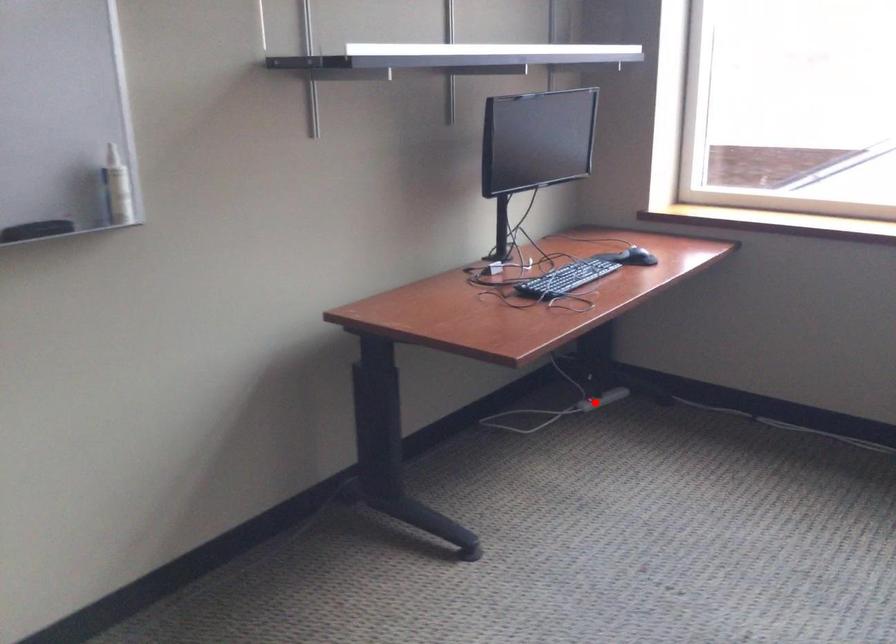
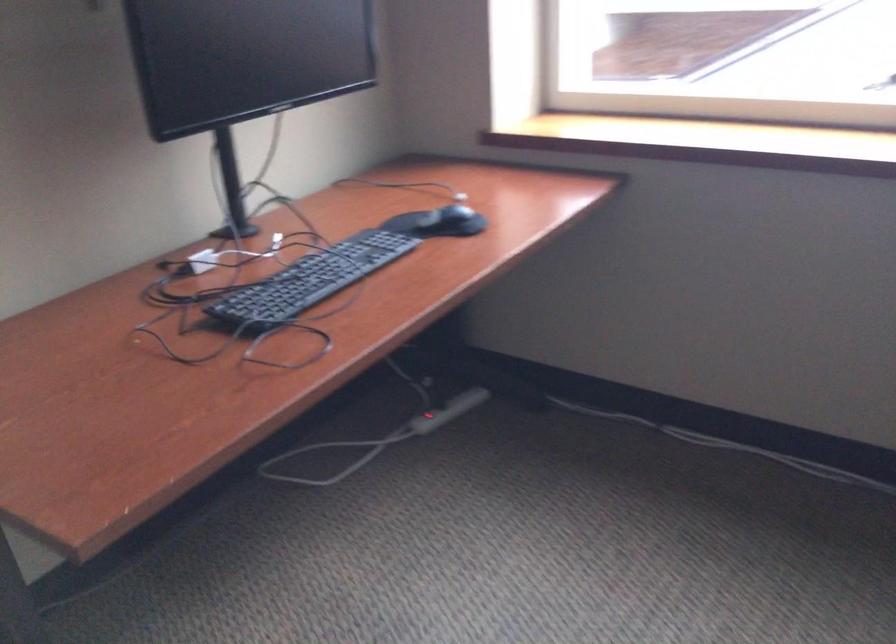
Question: I am providing you with two images of the same scene from different viewpoints. A red point is shown in image1. For the corresponding object point in image2, is it positioned nearer or farther from the camera?

Choices:
 (A) Nearer
 (B) Farther

Answer: (A)